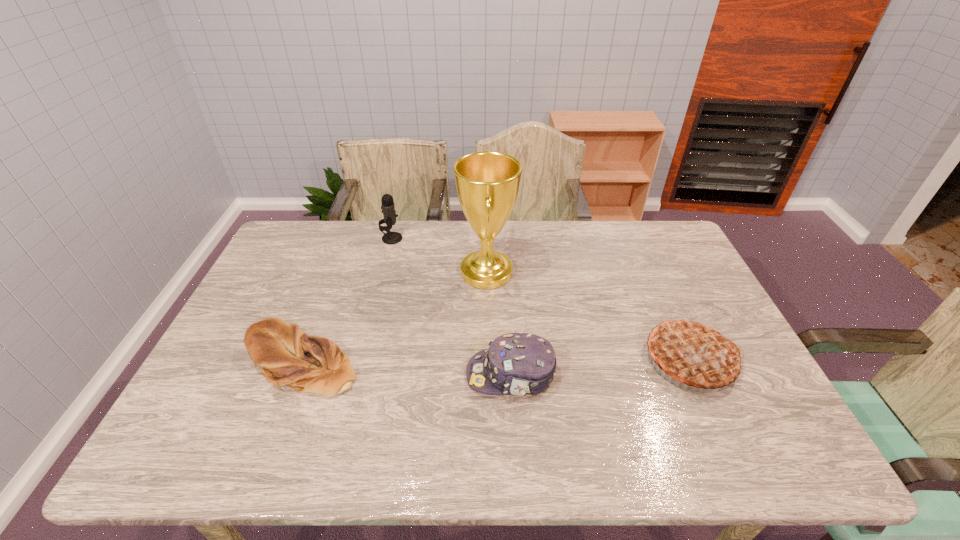
I want to click on award, so click(487, 183).

Locate an element on the screen. microphone is located at coordinates (388, 209).

What are the coordinates of `pie` in the screenshot? It's located at (693, 352).

The image size is (960, 540). I want to click on the fourth tallest object, so click(522, 364).

Find the location of a particular element. the shortest object is located at coordinates (287, 356).

This screenshot has width=960, height=540. In order to click on free spot located by the handles of the tallest object in this screenshot , I will do `click(371, 272)`.

Where is `vacant space located by the handles of the tallest object`? This screenshot has height=540, width=960. vacant space located by the handles of the tallest object is located at coordinates (396, 272).

At what (x,y) coordinates should I click in order to perform the action: click on free space located by the handles of the tallest object. Please return your answer as a coordinate pair (x, y). Looking at the image, I should click on (358, 272).

Where is `vacant region located on the left of the microphone`? The width and height of the screenshot is (960, 540). vacant region located on the left of the microphone is located at coordinates (364, 239).

Locate an element on the screen. This screenshot has width=960, height=540. vacant space located 0.090m on the front of the pie is located at coordinates (723, 431).